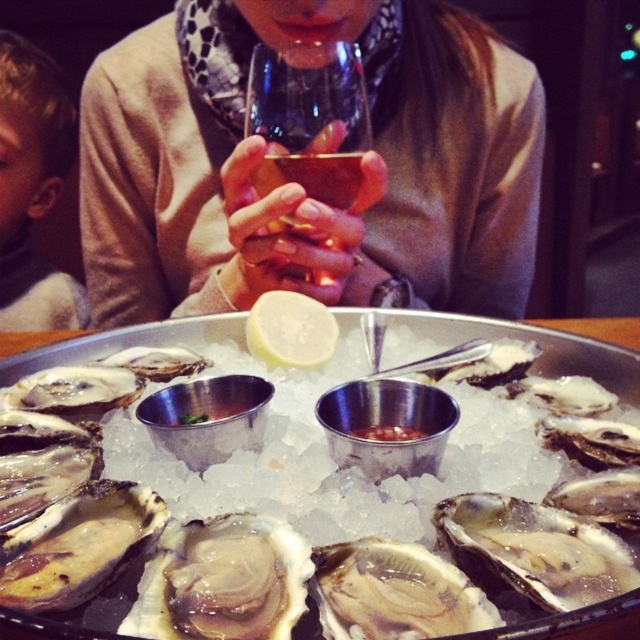
You are at a dinner party and want to place both the matte beige sweater at center and the shiny silver oyster at center on a small serving tray that can only hold one item at a time. Which item should you choose to fit on the tray first based on their sizes?

The shiny silver oyster at center is smaller in size compared to the matte beige sweater at center, so it will fit on the tray first.

You are at a dinner party and want to grab both the transparent glass wine glass at center and the shiny silver oyster at center. If you can only reach a distance of 12 inches, can you grab both items without moving your hand?

The transparent glass wine glass at center is 11.92 inches from the shiny silver oyster at center, which is within your 12 inch reach. Yes, you can grab both items without moving your hand.

You are a fashion designer who needs to measure the distance between the matte beige sweater at center and the viewer. What is the exact distance in inches?

The distance of matte beige sweater at center from viewer is 28.28 inches.